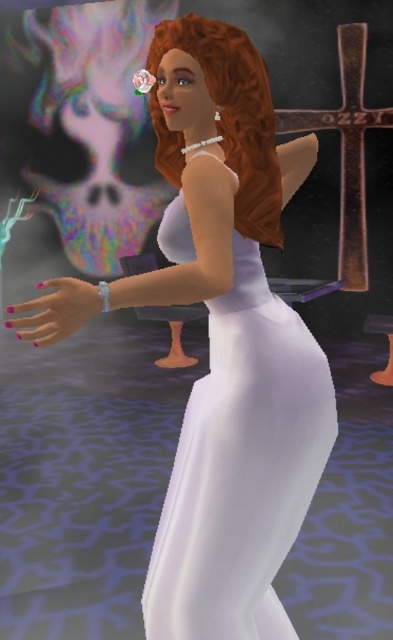
How much distance is there between satin white dress at center and curly auburn hair at center?

satin white dress at center is 18.96 inches from curly auburn hair at center.

Which is in front, point (207, 620) or point (247, 192)?

Point (207, 620) is more forward.

Find the location of a particular element. The image size is (393, 640). satin white dress at center is located at coordinates pyautogui.click(x=240, y=467).